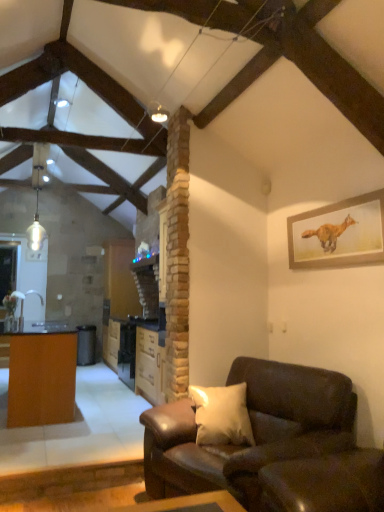
Question: From a real-world perspective, is brown wood cabinet at center on wooden framed fox painting at upper right?

Choices:
 (A) yes
 (B) no

Answer: (B)

Question: Is brown wood cabinet at center positioned in front of wooden framed fox painting at upper right?

Choices:
 (A) no
 (B) yes

Answer: (A)

Question: Considering the relative sizes of brown wood cabinet at center and wooden framed fox painting at upper right in the image provided, is brown wood cabinet at center wider than wooden framed fox painting at upper right?

Choices:
 (A) no
 (B) yes

Answer: (B)

Question: Considering the relative positions of brown wood cabinet at center and wooden framed fox painting at upper right in the image provided, is brown wood cabinet at center to the left of wooden framed fox painting at upper right from the viewer's perspective?

Choices:
 (A) no
 (B) yes

Answer: (B)

Question: Is wooden framed fox painting at upper right at the back of brown wood cabinet at center?

Choices:
 (A) no
 (B) yes

Answer: (A)

Question: Is brown wood cabinet at center bigger or smaller than leather couch at lower right?

Choices:
 (A) small
 (B) big

Answer: (A)

Question: Is brown wood cabinet at center to the left or to the right of leather couch at lower right in the image?

Choices:
 (A) left
 (B) right

Answer: (A)

Question: Considering the positions of brown wood cabinet at center and leather couch at lower right in the image, is brown wood cabinet at center wider or thinner than leather couch at lower right?

Choices:
 (A) thin
 (B) wide

Answer: (A)

Question: Is point (x=155, y=373) closer or farther from the camera than point (x=198, y=480)?

Choices:
 (A) farther
 (B) closer

Answer: (A)

Question: Considering the positions of point (182, 416) and point (21, 335), is point (182, 416) closer or farther from the camera than point (21, 335)?

Choices:
 (A) farther
 (B) closer

Answer: (B)

Question: From a real-world perspective, is leather couch at lower right physically located above or below wooden table at left?

Choices:
 (A) above
 (B) below

Answer: (B)

Question: Would you say leather couch at lower right is to the left or to the right of wooden table at left in the picture?

Choices:
 (A) right
 (B) left

Answer: (A)

Question: From the image's perspective, is leather couch at lower right located above or below wooden table at left?

Choices:
 (A) above
 (B) below

Answer: (A)

Question: Is point (46, 387) positioned closer to the camera than point (311, 251)?

Choices:
 (A) closer
 (B) farther

Answer: (B)

Question: From the image's perspective, is wooden table at left positioned above or below wooden framed fox painting at upper right?

Choices:
 (A) above
 (B) below

Answer: (B)